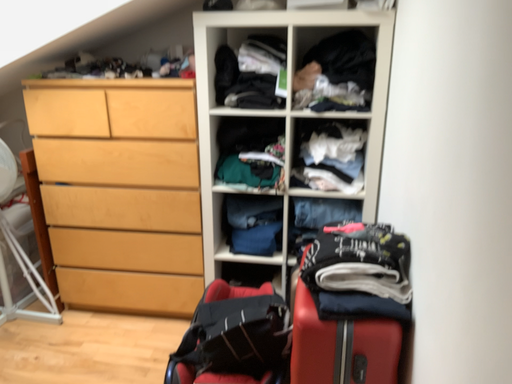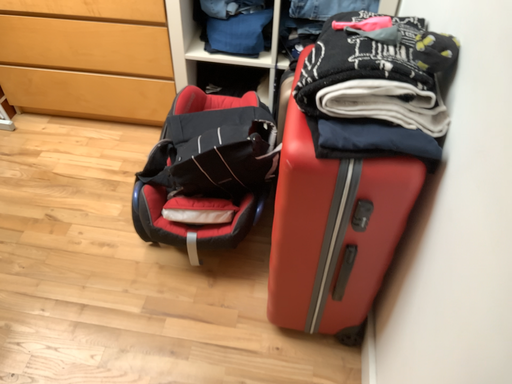
Question: How did the camera likely rotate when shooting the video?

Choices:
 (A) rotated upward
 (B) rotated downward

Answer: (B)